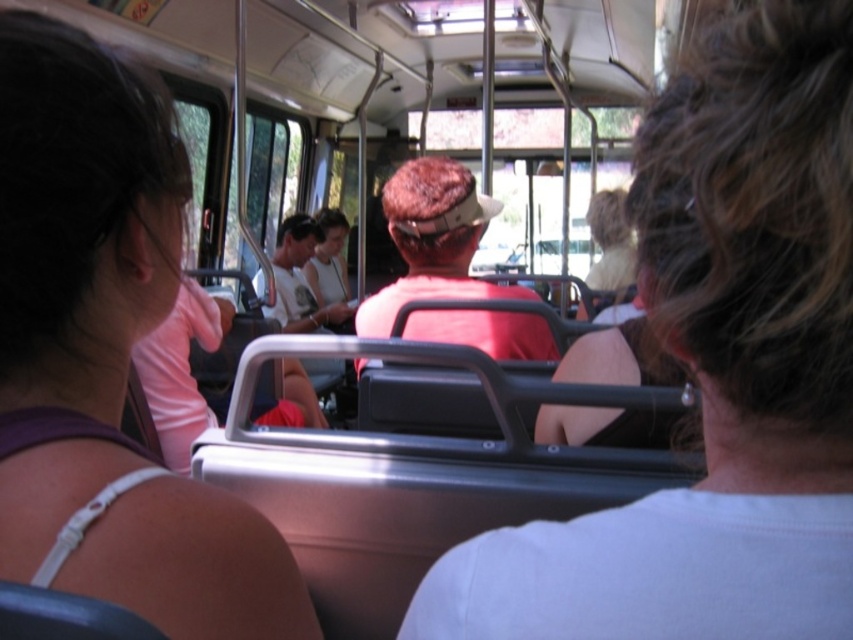
Question: Which point appears closest to the camera in this image?

Choices:
 (A) pos(61,417)
 (B) pos(575,573)

Answer: (B)

Question: Which point is closer to the camera?

Choices:
 (A) purple fabric shirt at upper left
 (B) matte red shirt at center

Answer: (A)

Question: Considering the real-world distances, which object is farthest from the purple fabric shirt at upper left?

Choices:
 (A) white matte hair at upper right
 (B) matte red shirt at center

Answer: (B)

Question: Can you confirm if purple fabric shirt at upper left is bigger than matte red shirt at center?

Choices:
 (A) yes
 (B) no

Answer: (B)

Question: Does white matte hair at upper right lie in front of matte red shirt at center?

Choices:
 (A) yes
 (B) no

Answer: (A)

Question: Does purple fabric shirt at upper left have a larger size compared to matte red shirt at center?

Choices:
 (A) yes
 (B) no

Answer: (B)